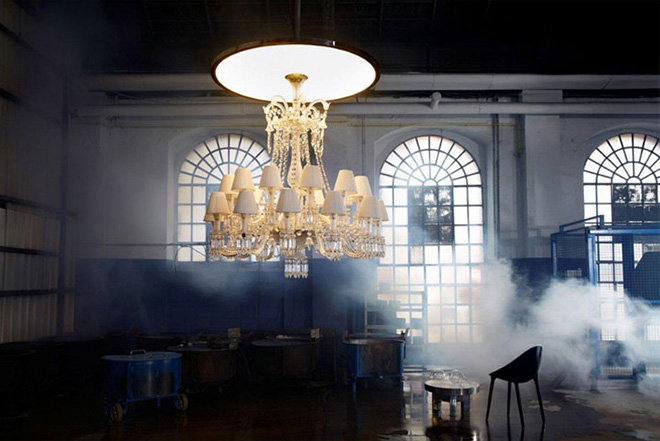
This screenshot has height=441, width=660. I want to click on light, so click(315, 75).